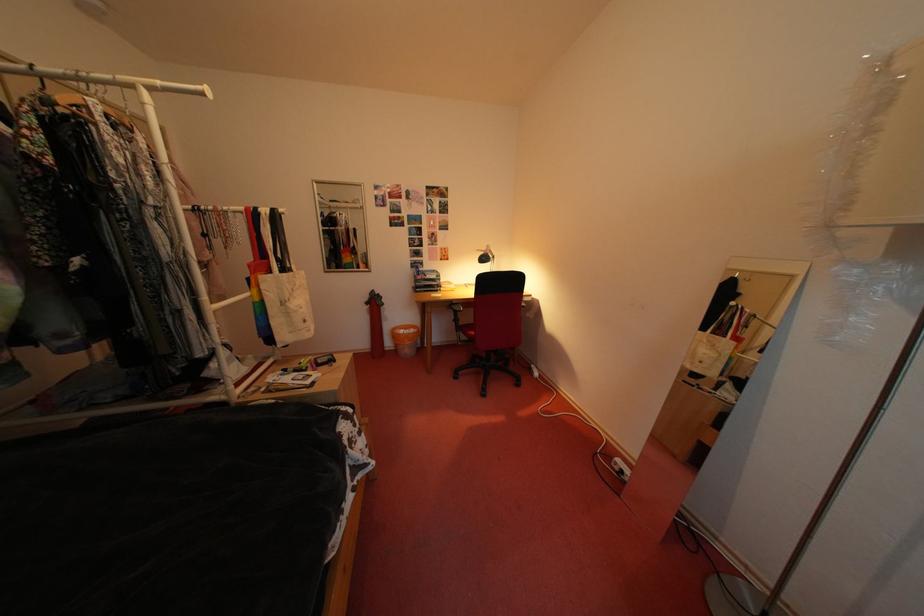
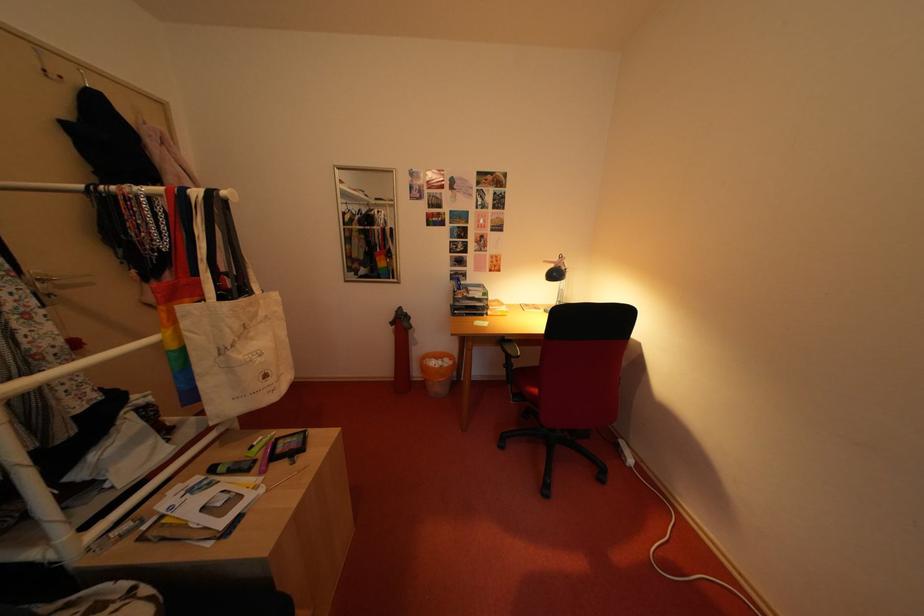
Question: How did the camera likely rotate?

Choices:
 (A) Left
 (B) Right
 (C) Up
 (D) Down

Answer: (A)